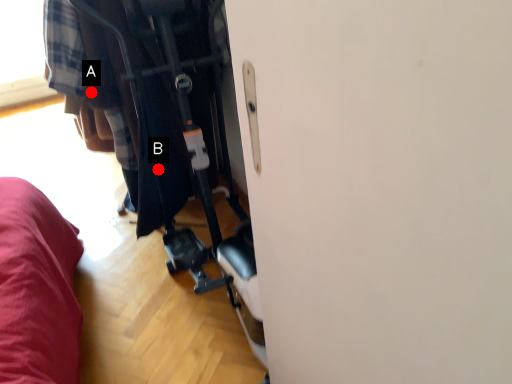
Question: Two points are circled on the image, labeled by A and B beside each circle. Which point is farther to the camera?

Choices:
 (A) A is further
 (B) B is further

Answer: (B)